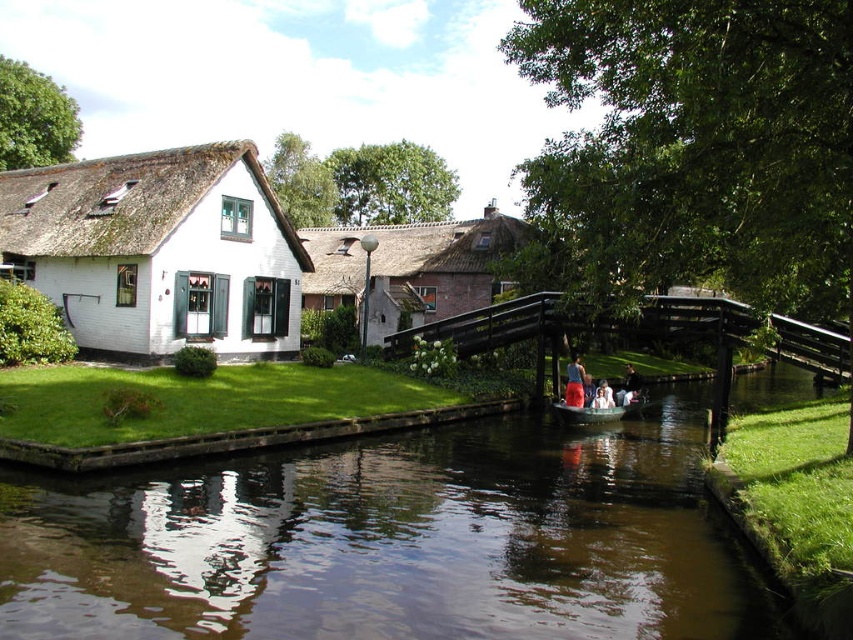
Question: Which of the following is the closest to the observer?

Choices:
 (A) thatched roof cottage at center
 (B) wooden boat at center
 (C) brown wooden bridge at center
 (D) white thatched roof cottage at left

Answer: (C)

Question: Which point is closer to the camera?

Choices:
 (A) brown reflective water at center
 (B) brown wooden bridge at center
 (C) white thatched roof cottage at left
 (D) thatched roof cottage at center

Answer: (A)

Question: Which of the following is the farthest from the observer?

Choices:
 (A) (416, 308)
 (B) (234, 156)
 (C) (569, 404)

Answer: (A)

Question: Does thatched roof cottage at center lie in front of brown wooden bridge at center?

Choices:
 (A) yes
 (B) no

Answer: (B)

Question: Is brown reflective water at center below white thatched roof cottage at left?

Choices:
 (A) yes
 (B) no

Answer: (A)

Question: Is thatched roof cottage at center to the right of matte blue shorts at lower center from the viewer's perspective?

Choices:
 (A) yes
 (B) no

Answer: (B)